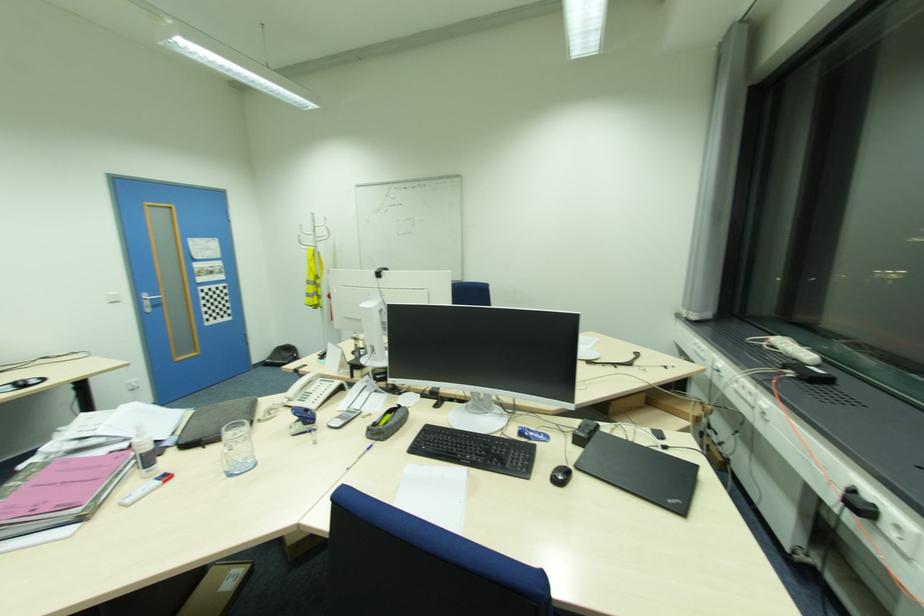
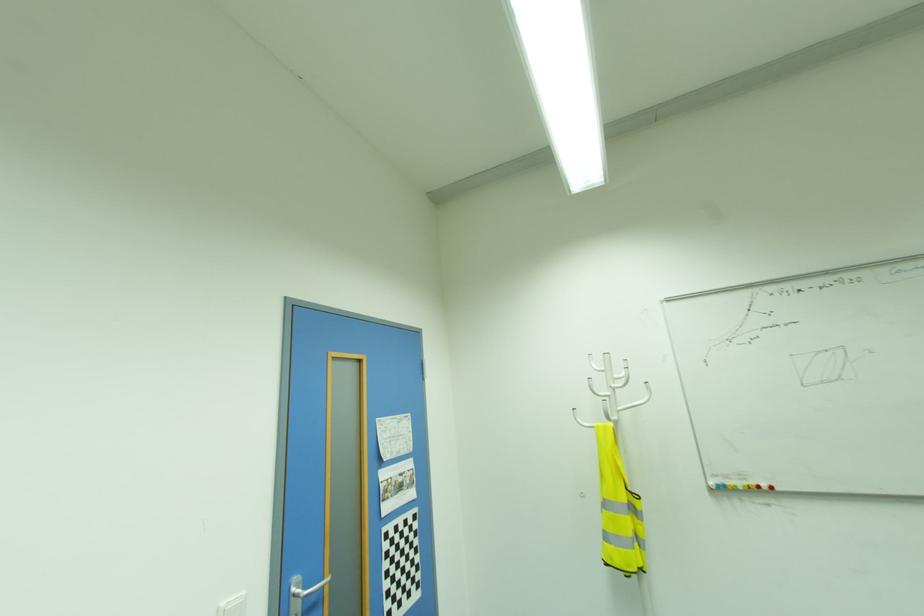
The point at (147,297) is marked in the first image. Where is the corresponding point in the second image?

(296, 590)